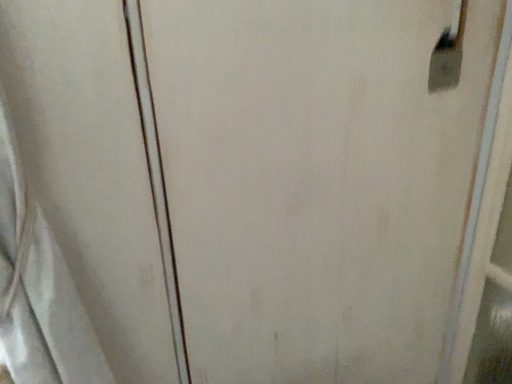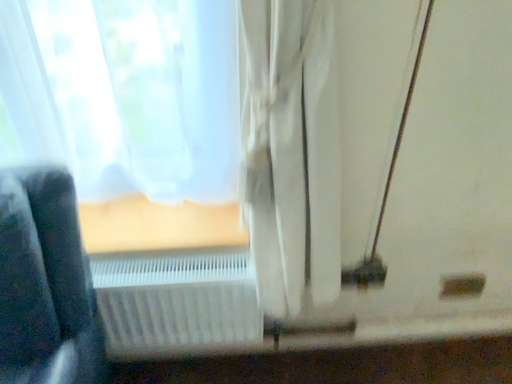
Question: How did the camera likely rotate when shooting the video?

Choices:
 (A) rotated upward
 (B) rotated downward

Answer: (B)